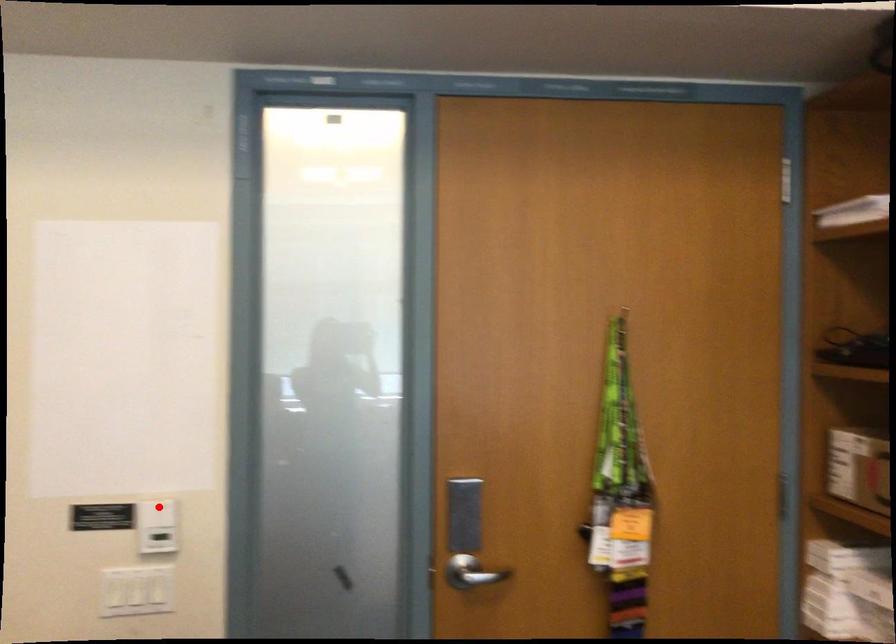
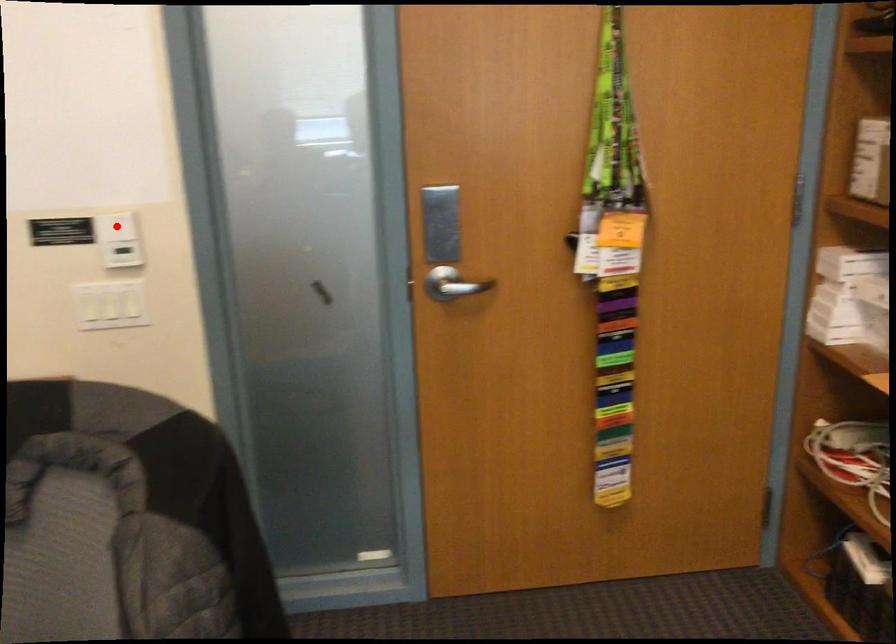
I am providing you with two images of the same scene from different viewpoints. A red point is marked on the first image and another point is marked on the second image. Are the points marked in image1 and image2 representing the same 3D position?

Yes